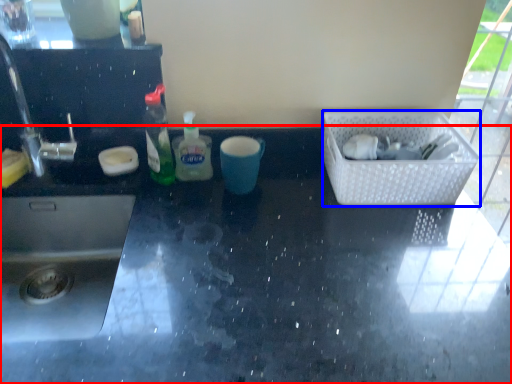
Question: Among these objects, which one is nearest to the camera, countertop (highlighted by a red box) or basket (highlighted by a blue box)?

Choices:
 (A) countertop
 (B) basket

Answer: (A)